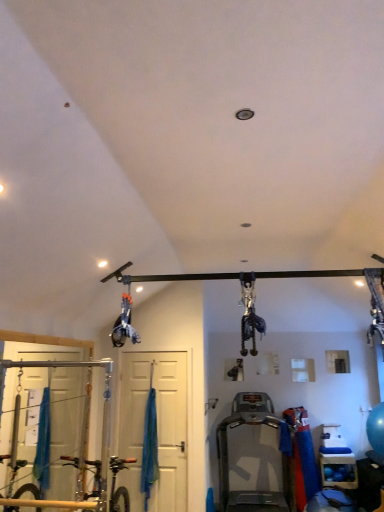
Question: Can you confirm if white matte door at center is smaller than silver metallic treadmill at center?

Choices:
 (A) no
 (B) yes

Answer: (B)

Question: Can you confirm if white matte door at center is positioned to the right of silver metallic treadmill at center?

Choices:
 (A) no
 (B) yes

Answer: (A)

Question: Considering the relative positions of white matte door at center and silver metallic treadmill at center in the image provided, is white matte door at center to the left of silver metallic treadmill at center from the viewer's perspective?

Choices:
 (A) no
 (B) yes

Answer: (B)

Question: Considering the relative sizes of white matte door at center and silver metallic treadmill at center in the image provided, is white matte door at center shorter than silver metallic treadmill at center?

Choices:
 (A) yes
 (B) no

Answer: (B)

Question: From the image's perspective, is white matte door at center on silver metallic treadmill at center?

Choices:
 (A) yes
 (B) no

Answer: (A)

Question: Looking at the image, does silver metallic treadmill at center seem bigger or smaller compared to blue rubber balls at lower right?

Choices:
 (A) small
 (B) big

Answer: (B)

Question: From the image's perspective, is silver metallic treadmill at center positioned above or below blue rubber balls at lower right?

Choices:
 (A) above
 (B) below

Answer: (A)

Question: Considering their positions, is silver metallic treadmill at center located in front of or behind blue rubber balls at lower right?

Choices:
 (A) behind
 (B) front

Answer: (B)

Question: From their relative heights in the image, would you say silver metallic treadmill at center is taller or shorter than blue rubber balls at lower right?

Choices:
 (A) tall
 (B) short

Answer: (A)

Question: Is point (145, 430) positioned closer to the camera than point (256, 416)?

Choices:
 (A) closer
 (B) farther

Answer: (A)

Question: Is blue fabric curtain at center bigger or smaller than silver metallic treadmill at center?

Choices:
 (A) big
 (B) small

Answer: (B)

Question: Is blue fabric curtain at center taller or shorter than silver metallic treadmill at center?

Choices:
 (A) short
 (B) tall

Answer: (B)

Question: Is blue fabric curtain at center in front of or behind silver metallic treadmill at center in the image?

Choices:
 (A) behind
 (B) front

Answer: (A)

Question: Based on their positions, is blue rubber balls at lower right located to the left or right of blue fabric curtain at center?

Choices:
 (A) right
 (B) left

Answer: (A)

Question: In the image, is blue rubber balls at lower right positioned in front of or behind blue fabric curtain at center?

Choices:
 (A) behind
 (B) front

Answer: (A)